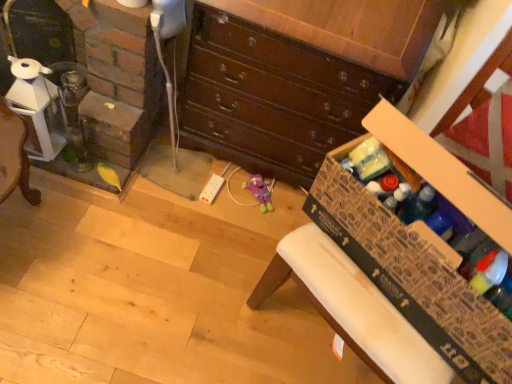
The height and width of the screenshot is (384, 512). Describe the element at coordinates (272, 97) in the screenshot. I see `wooden chest of drawers at center` at that location.

At what (x,y) coordinates should I click in order to perform the action: click on wooden chest of drawers at center. Please return your answer as a coordinate pair (x, y). This screenshot has height=384, width=512. Looking at the image, I should click on (272, 97).

What is the approximate width of clear glass fireplace at left?

The width of clear glass fireplace at left is 25.33 inches.

At what (x,y) coordinates should I click in order to perform the action: click on clear glass fireplace at left. Please return your answer as a coordinate pair (x, y). Looking at the image, I should click on (131, 82).

I want to click on cardboard box at lower right, so click(x=412, y=276).

How distant is wooden chest of drawers at center from clear glass fireplace at left?

wooden chest of drawers at center and clear glass fireplace at left are 11.64 inches apart from each other.

Find the location of a particular element. chest of drawers below the clear glass fireplace at left (from the image's perspective) is located at coordinates (272, 97).

From the image's perspective, would you say wooden chest of drawers at center is positioned over clear glass fireplace at left?

No.

Which is in front, wooden chest of drawers at center or clear glass fireplace at left?

wooden chest of drawers at center is in front.

Is cardboard box at lower right in contact with wooden chest of drawers at center?

No.

From a real-world perspective, who is located lower, cardboard box at lower right or wooden chest of drawers at center?

From a 3D spatial view, wooden chest of drawers at center is below.

From the image's perspective, is cardboard box at lower right beneath wooden chest of drawers at center?

Yes, from the image's perspective, cardboard box at lower right is beneath wooden chest of drawers at center.

Which of these two, cardboard box at lower right or wooden chest of drawers at center, is wider?

Wider between the two is wooden chest of drawers at center.

In terms of height, does clear glass fireplace at left look taller or shorter compared to cardboard box at lower right?

clear glass fireplace at left is taller than cardboard box at lower right.

From the image's perspective, does clear glass fireplace at left appear lower than cardboard box at lower right?

No, from the image's perspective, clear glass fireplace at left is not beneath cardboard box at lower right.

From a real-world perspective, between clear glass fireplace at left and cardboard box at lower right, who is vertically higher?

cardboard box at lower right, from a real-world perspective.

Is clear glass fireplace at left to the left of cardboard box at lower right from the viewer's perspective?

Correct, you'll find clear glass fireplace at left to the left of cardboard box at lower right.

Measure the distance between wooden chest of drawers at center and cardboard box at lower right.

wooden chest of drawers at center is 23.55 inches from cardboard box at lower right.

Where is `cardboard box that appears in front of the wooden chest of drawers at center`? The image size is (512, 384). cardboard box that appears in front of the wooden chest of drawers at center is located at coordinates (412, 276).

Is wooden chest of drawers at center positioned with its back to cardboard box at lower right?

wooden chest of drawers at center is not turned away from cardboard box at lower right.

Would you say wooden chest of drawers at center contains cardboard box at lower right?

No, cardboard box at lower right is not a part of wooden chest of drawers at center.

From the image's perspective, is cardboard box at lower right beneath clear glass fireplace at left?

Yes, from the image's perspective, cardboard box at lower right is beneath clear glass fireplace at left.

Can you confirm if cardboard box at lower right is thinner than clear glass fireplace at left?

Yes, cardboard box at lower right is thinner than clear glass fireplace at left.

From a real-world perspective, between cardboard box at lower right and clear glass fireplace at left, who is vertically lower?

In real-world perspective, clear glass fireplace at left is lower.

Is cardboard box at lower right with clear glass fireplace at left?

They are not placed beside each other.

Is clear glass fireplace at left inside the boundaries of wooden chest of drawers at center, or outside?

The correct answer is: outside.

Is clear glass fireplace at left directly adjacent to wooden chest of drawers at center?

No.

Is point (137, 29) positioned behind point (368, 84)?

No, it is in front of (368, 84).

From the image's perspective, which object appears higher, clear glass fireplace at left or wooden chest of drawers at center?

From the image's view, clear glass fireplace at left is above.

Locate an element on the screen. chest of drawers above the clear glass fireplace at left (from a real-world perspective) is located at coordinates (272, 97).

I want to click on cardboard box on the right of wooden chest of drawers at center, so click(412, 276).

Estimate the real-world distances between objects in this image. Which object is closer to clear glass fireplace at left, cardboard box at lower right or wooden chest of drawers at center?

Among the two, wooden chest of drawers at center is located nearer to clear glass fireplace at left.

When comparing their distances from wooden chest of drawers at center, does cardboard box at lower right or clear glass fireplace at left seem further?

cardboard box at lower right is positioned further to the anchor wooden chest of drawers at center.

When comparing their distances from cardboard box at lower right, does wooden chest of drawers at center or clear glass fireplace at left seem further?

The object further to cardboard box at lower right is clear glass fireplace at left.

From the image, which object appears to be nearer to wooden chest of drawers at center, clear glass fireplace at left or cardboard box at lower right?

Based on the image, clear glass fireplace at left appears to be nearer to wooden chest of drawers at center.

Considering their positions, is clear glass fireplace at left positioned closer to cardboard box at lower right than wooden chest of drawers at center?

wooden chest of drawers at center is closer to cardboard box at lower right.

Looking at the image, which one is located further to clear glass fireplace at left, wooden chest of drawers at center or cardboard box at lower right?

Based on the image, cardboard box at lower right appears to be further to clear glass fireplace at left.

This screenshot has height=384, width=512. In order to click on chest of drawers between clear glass fireplace at left and cardboard box at lower right in the horizontal direction in this screenshot , I will do `click(272, 97)`.